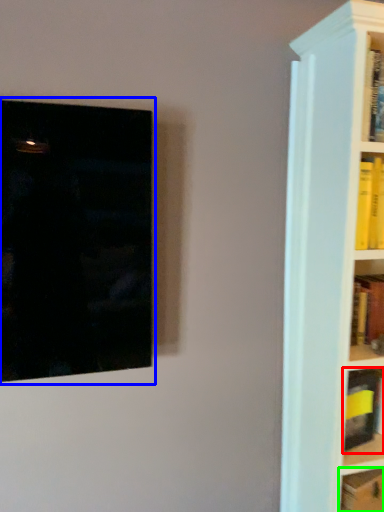
Question: Considering the real-world distances, which object is closest to book (highlighted by a red box)? picture frame (highlighted by a blue box) or book (highlighted by a green box).

Choices:
 (A) picture frame
 (B) book

Answer: (B)